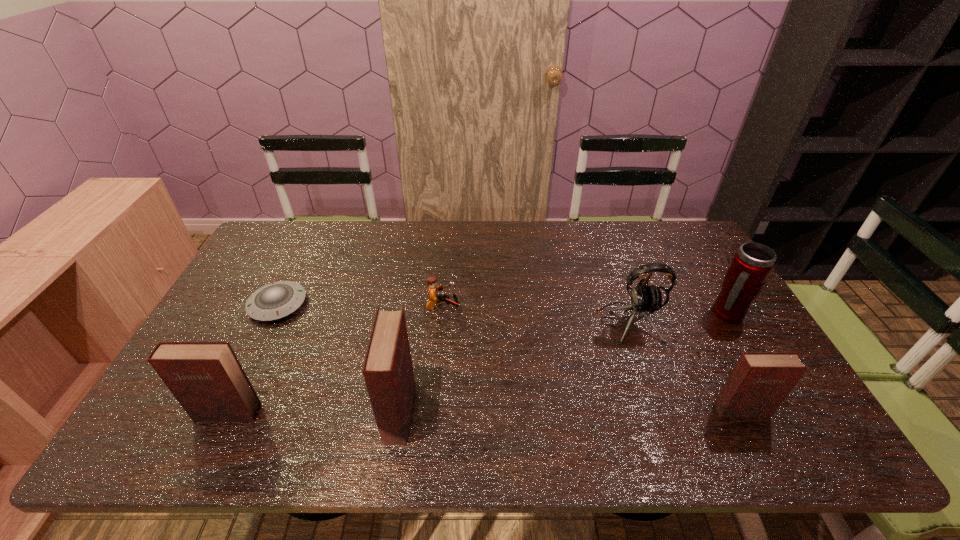
Locate an element on the screen. The height and width of the screenshot is (540, 960). free point that satisfies the following two spatial constraints: 1. on the front cover of the second diary from right to left; 2. on the front cover of the second tallest diary is located at coordinates (399, 413).

In order to click on vacant region that satisfies the following two spatial constraints: 1. on the front cover of the fifth object from right to left; 2. on the front cover of the second tallest diary in this screenshot , I will do `click(399, 413)`.

Locate an element on the screen. free space in the image that satisfies the following two spatial constraints: 1. on the front cover of the shortest diary; 2. on the front cover of the second diary from right to left is located at coordinates (742, 412).

Find the location of `blank space that satisfies the following two spatial constraints: 1. holding a crossbow in the hands of the fourth object from left to right; 2. on the right side of the third object from right to left`. blank space that satisfies the following two spatial constraints: 1. holding a crossbow in the hands of the fourth object from left to right; 2. on the right side of the third object from right to left is located at coordinates (442, 322).